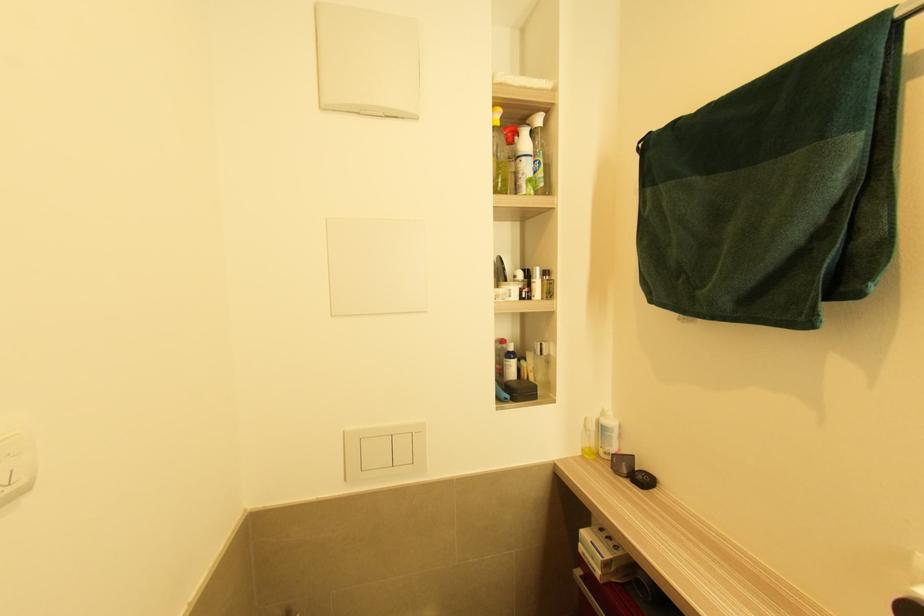
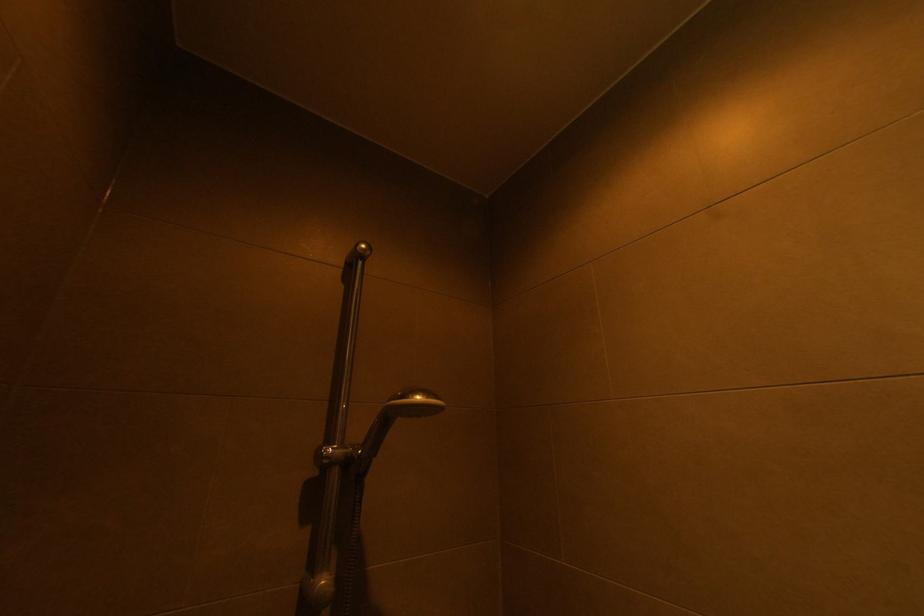
The images are taken continuously from a first-person perspective. In which direction is your viewpoint rotating?

The rotation direction of the camera is right-up.